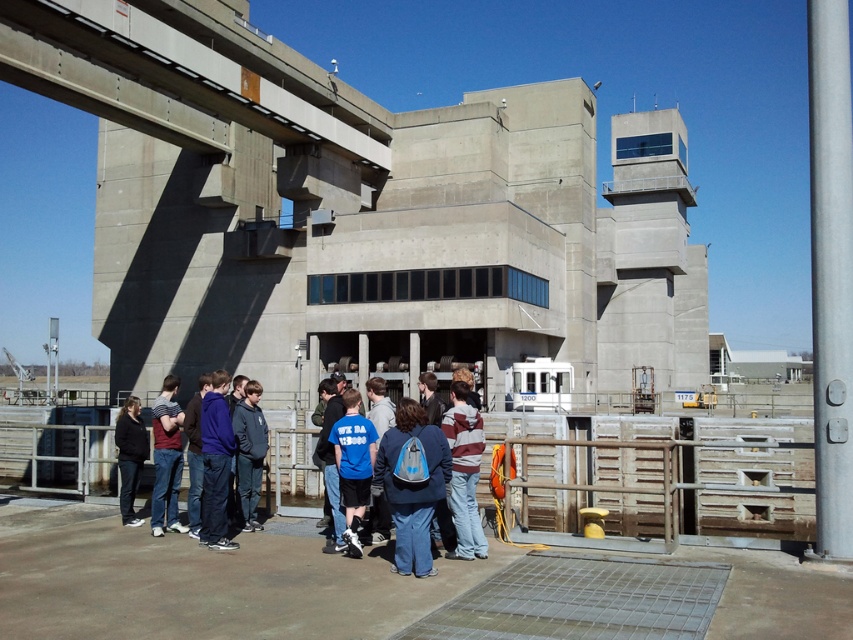
Does white matte ferry at center have a greater height compared to dark gray hoodie at center?

No, white matte ferry at center is not taller than dark gray hoodie at center.

Who is more forward, (526, 392) or (125, 413)?

Positioned in front is point (125, 413).

The image size is (853, 640). I want to click on white matte ferry at center, so click(x=538, y=385).

Is striped sweater at center taller than dark blue hoodie at center?

Incorrect, striped sweater at center's height is not larger of dark blue hoodie at center's.

Is striped sweater at center to the left of dark blue hoodie at center from the viewer's perspective?

In fact, striped sweater at center is to the right of dark blue hoodie at center.

Measure the distance between striped sweater at center and camera.

striped sweater at center is 22.53 feet away from camera.

Identify the location of striped sweater at center. (463, 472).

Is point (160, 508) closer to viewer compared to point (126, 444)?

Yes, point (160, 508) is closer to viewer.

Which is behind, point (163, 388) or point (119, 452)?

Positioned behind is point (119, 452).

Who is more distant from viewer, (161, 506) or (126, 416)?

Point (126, 416)

This screenshot has width=853, height=640. What are the coordinates of `dark blue jeans at lower left` in the screenshot? It's located at (166, 458).